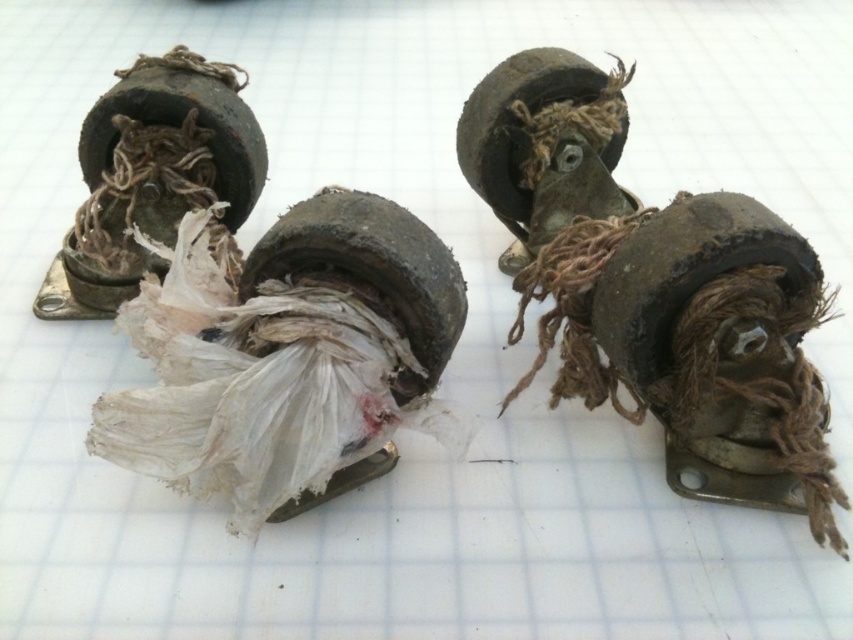
Question: Is rusty metal roller skate at center wider than rusty metal wheel at upper right?

Choices:
 (A) yes
 (B) no

Answer: (A)

Question: Is rusty metal roller skate at center below rusty metal wheel at upper right?

Choices:
 (A) no
 (B) yes

Answer: (B)

Question: Does rusty metal roller skate at center come behind rusty metal wheel at upper right?

Choices:
 (A) no
 (B) yes

Answer: (A)

Question: Which object appears farthest from the camera in this image?

Choices:
 (A) rusty metal roller skate at center
 (B) rusty metal wheel at upper right

Answer: (B)